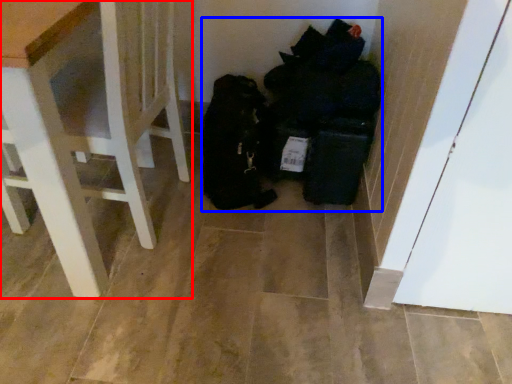
Question: Among these objects, which one is farthest to the camera, furniture (highlighted by a red box) or garbage (highlighted by a blue box)?

Choices:
 (A) furniture
 (B) garbage

Answer: (B)